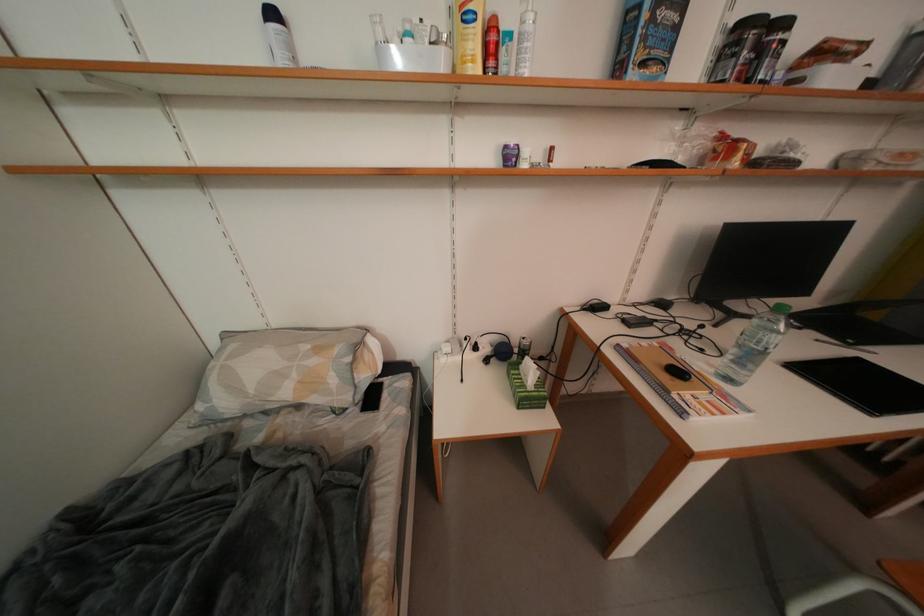
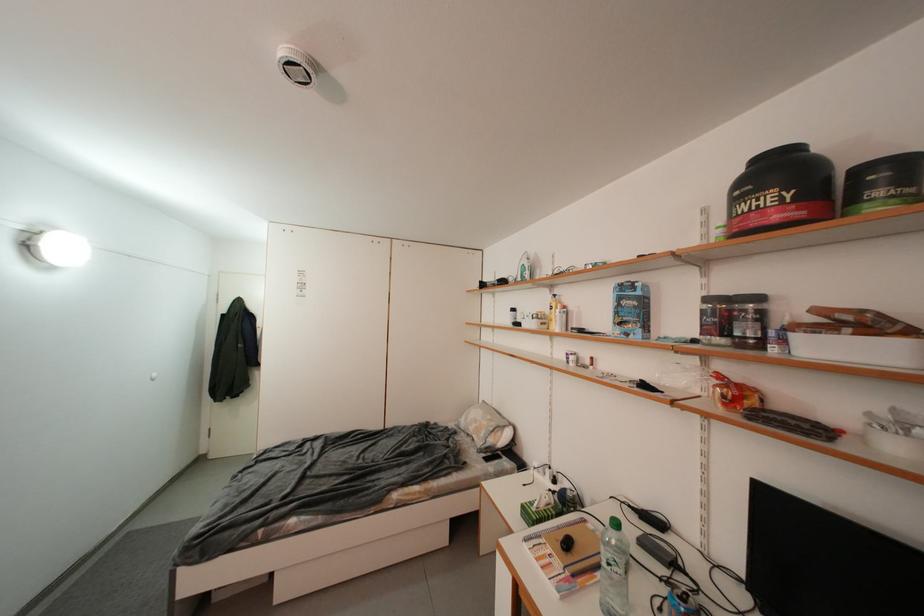
Question: I am providing you with two images of the same scene from different viewpoints. Please identify which objects are invisible in image2.

Choices:
 (A) black creatine container
 (B) green bottle cap
 (C) bag of bread
 (D) none of these

Answer: (D)